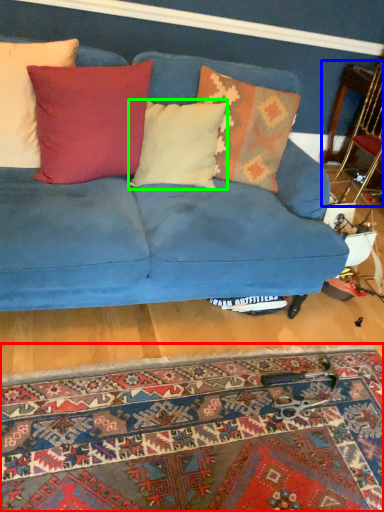
Question: Based on their relative distances, which object is nearer to mat (highlighted by a red box)? Choose from armchair (highlighted by a blue box) and pillow (highlighted by a green box).

Choices:
 (A) armchair
 (B) pillow

Answer: (B)